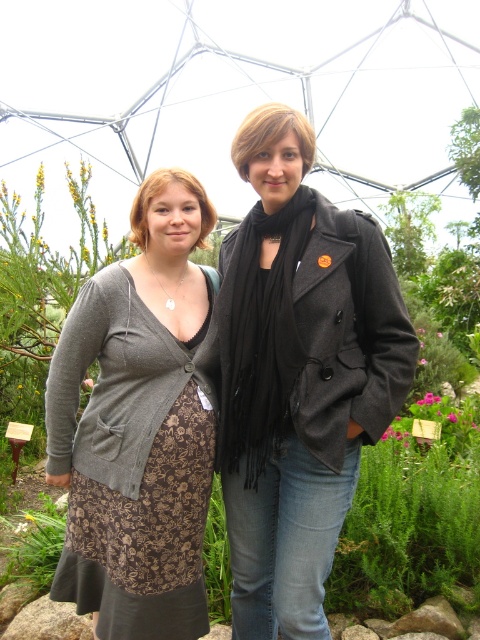
You are a photographer setting up a shoot in the botanical garden scene. You need to position a small tripod between the green leafy plant at lower left and the matte brown dress at center. Since the tripod requires 30 cm of space, will there be enough room between them?

The green leafy plant at lower left has a lesser height compared to matte brown dress at center, but the description does not provide information about the distance between them. Therefore, it is impossible to determine if there is enough space for the tripod.

You are a photographer setting up a shot of the two people in the botanical garden. You want to ensure that the matte black coat at center and the green leafy plant at lower left are both in frame. Which object should you position closer to the camera to make them appear the same size?

Since the matte black coat at center is taller than the green leafy plant at lower left, you should position the green leafy plant at lower left closer to the camera to make them appear the same size.

You are taking a photo of the two people in the botanical garden. You notice the matte black scarf at center and the matte brown dress at center. Which object should you focus on first to ensure both are in sharp focus?

You should focus on the matte black scarf at center first because it is closer to the viewer than the matte brown dress at center, so focusing on it will help ensure both are in sharp focus.